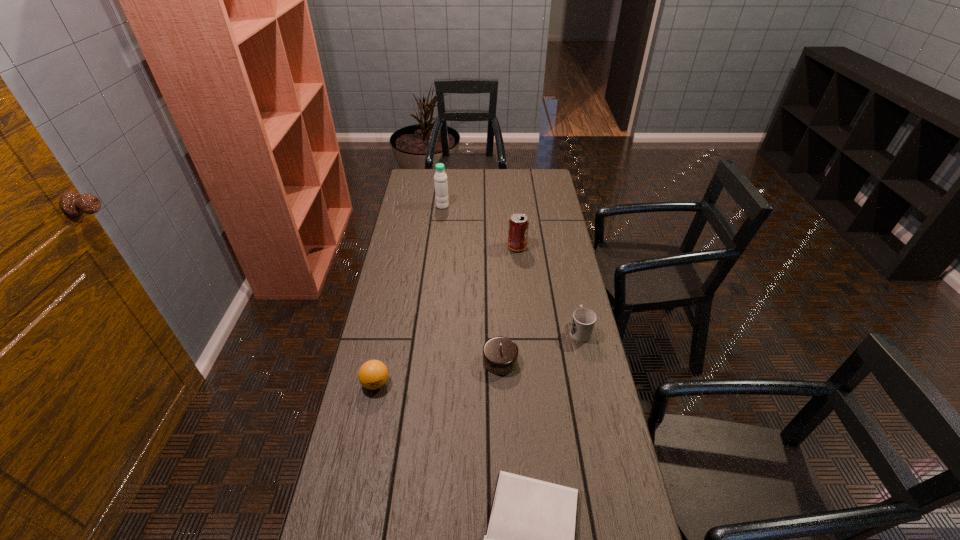
Find the location of a particular element. Image resolution: width=960 pixels, height=540 pixels. water bottle is located at coordinates (440, 178).

Image resolution: width=960 pixels, height=540 pixels. Identify the location of the fifth object from right to left. (440, 178).

The width and height of the screenshot is (960, 540). Find the location of `the fifth shortest object`. the fifth shortest object is located at coordinates (518, 225).

This screenshot has width=960, height=540. What are the coordinates of `the fifth nearest object` in the screenshot? It's located at point(518,225).

Identify the location of chocolate cake. (500, 354).

Where is `ping-pong ball`? ping-pong ball is located at coordinates (373, 374).

This screenshot has width=960, height=540. I want to click on the fourth nearest object, so click(x=583, y=321).

Where is `the rightmost object`? the rightmost object is located at coordinates (583, 321).

At what (x,y) coordinates should I click in order to perform the action: click on vacant space situated on the back of the second object from left to right. Please return your answer as a coordinate pair (x, y). Looking at the image, I should click on (446, 171).

The height and width of the screenshot is (540, 960). What are the coordinates of `vacant space located on the left of the soda can` in the screenshot? It's located at (459, 247).